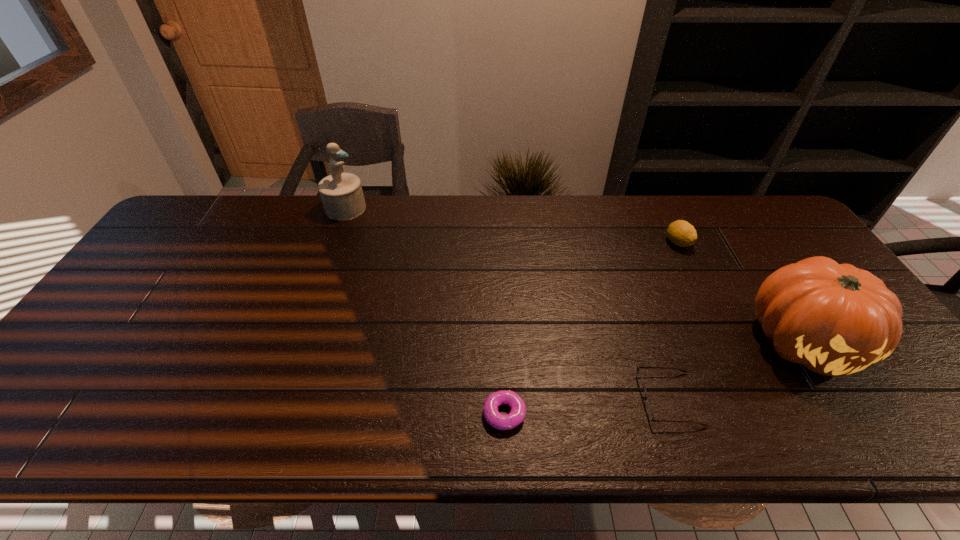
The width and height of the screenshot is (960, 540). In order to click on the farthest object in this screenshot , I will do `click(341, 193)`.

Where is `the leftmost object`? the leftmost object is located at coordinates (341, 193).

Identify the location of pumpkin. (835, 319).

Locate an element on the screen. Image resolution: width=960 pixels, height=540 pixels. the second object from right to left is located at coordinates (681, 233).

At what (x,y) coordinates should I click in order to perform the action: click on the second farthest object. Please return your answer as a coordinate pair (x, y). Looking at the image, I should click on (681, 233).

Identify the location of doughnut. This screenshot has height=540, width=960. (497, 420).

The image size is (960, 540). Find the location of `the third object from right to left`. the third object from right to left is located at coordinates (648, 407).

Where is `vacant space located 0.270m at the beak of the leftmost object`? vacant space located 0.270m at the beak of the leftmost object is located at coordinates point(445,208).

Image resolution: width=960 pixels, height=540 pixels. What are the coordinates of `free space located 0.310m at the stem end of the third tallest object` in the screenshot? It's located at (723, 335).

Identify the location of vacant region located 0.150m on the right of the doughnut. (594, 414).